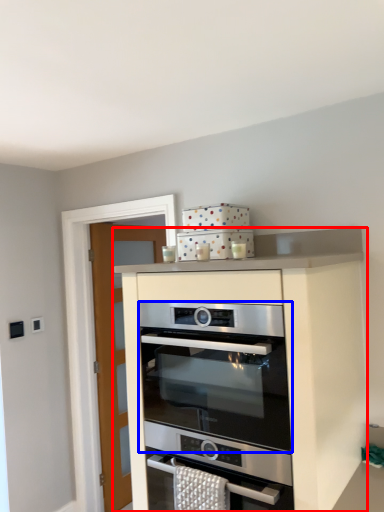
Question: Which point is further to the camera, cabinetry (highlighted by a red box) or oven (highlighted by a blue box)?

Choices:
 (A) cabinetry
 (B) oven

Answer: (B)